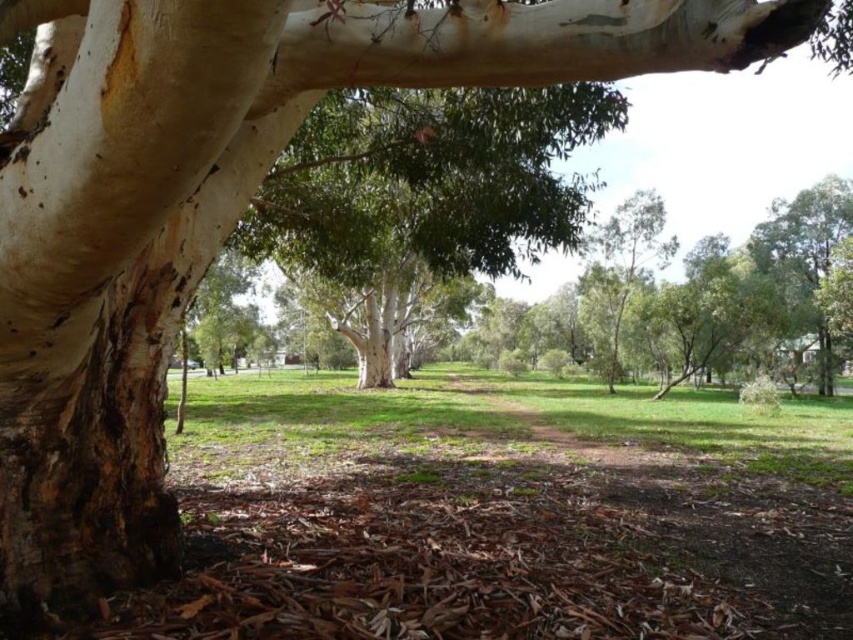
You are standing in the park and want to walk from the white rough bark tree trunk at left to the green grass at center. Which direction should you head?

You should head to the right towards the green grass at center since the white rough bark tree trunk at left is to the left of green grass at center.

You are planning to plant a new tree in your backyard. You have two options based on the image. The white rough bark tree trunk at left and the green leafy tree at center. If you want a smaller tree, which one should you choose?

The white rough bark tree trunk at left has a smaller size compared to the green leafy tree at center, so you should choose the white rough bark tree trunk at left if you want a smaller tree.

You are standing in the park and want to take a photo of both the green leafy tree at center and the green grass at center. How far apart are these two features from each other?

The green leafy tree at center is 18.96 feet away from the green grass at center.